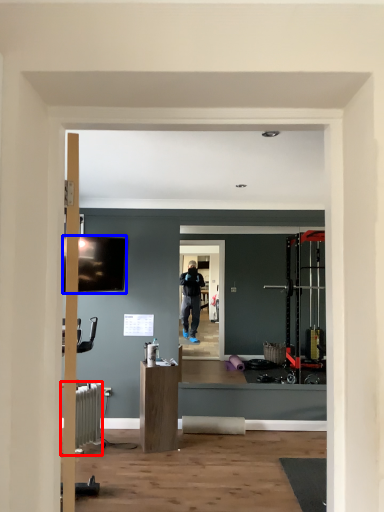
Question: Which of the following is the farthest to the observer, radiator (highlighted by a red box) or television (highlighted by a blue box)?

Choices:
 (A) radiator
 (B) television

Answer: (B)